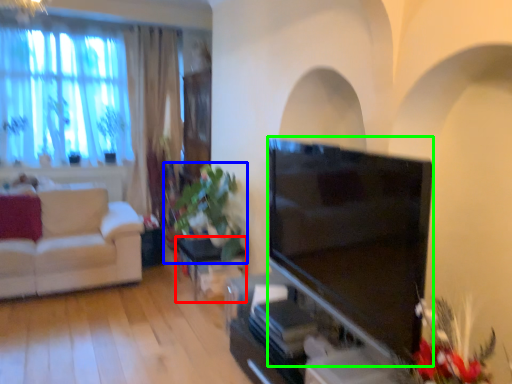
Question: Which is nearer to the table (highlighted by a red box)? houseplant (highlighted by a blue box) or television (highlighted by a green box).

Choices:
 (A) houseplant
 (B) television

Answer: (A)